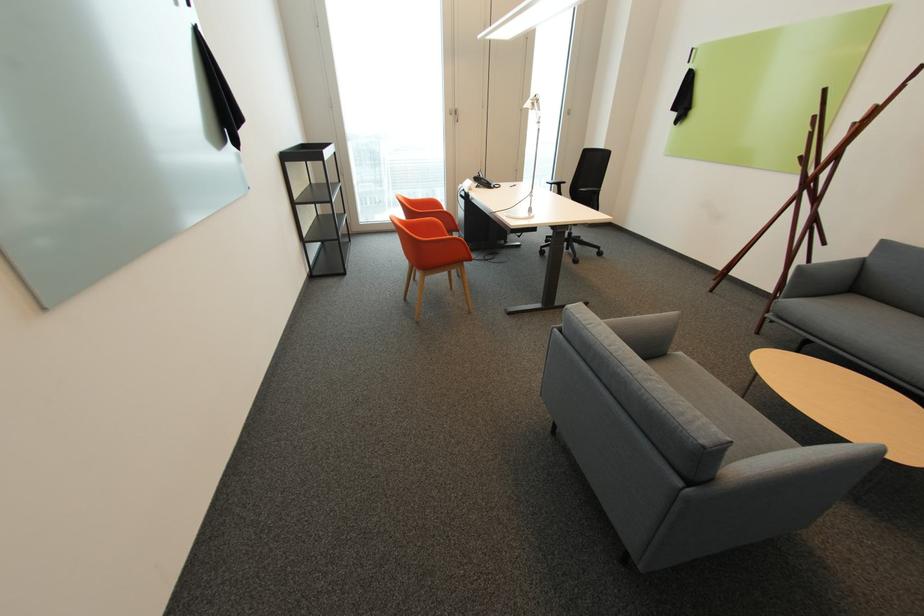
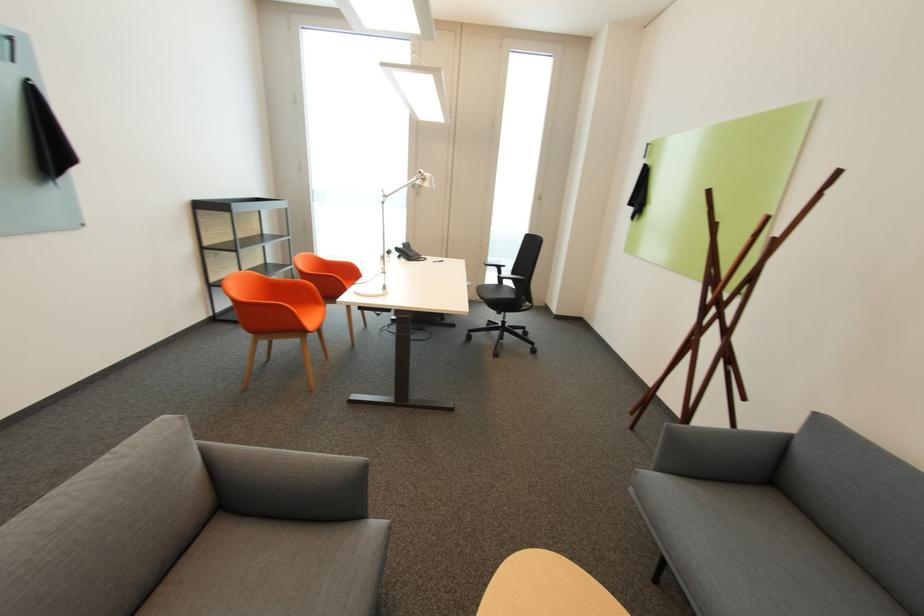
In the second image, find the point that corresponds to (x=563, y=187) in the first image.

(503, 269)